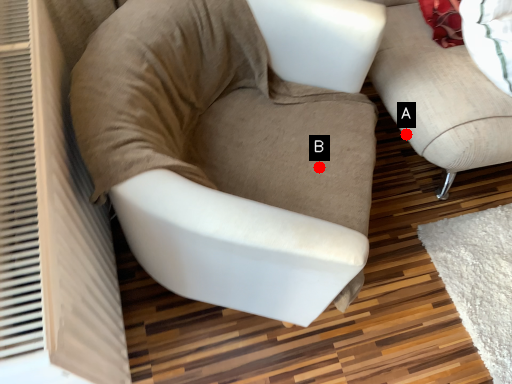
Question: Two points are circled on the image, labeled by A and B beside each circle. Among these points, which one is nearest to the camera?

Choices:
 (A) A is closer
 (B) B is closer

Answer: (B)